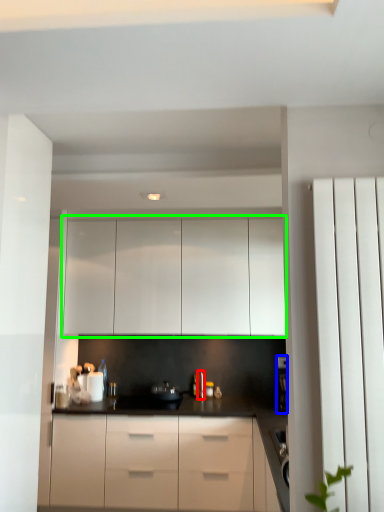
Question: Based on their relative distances, which object is nearer to faucet (highlighted by a red box)? Choose from coffee machine (highlighted by a blue box) and cabinetry (highlighted by a green box).

Choices:
 (A) coffee machine
 (B) cabinetry

Answer: (A)